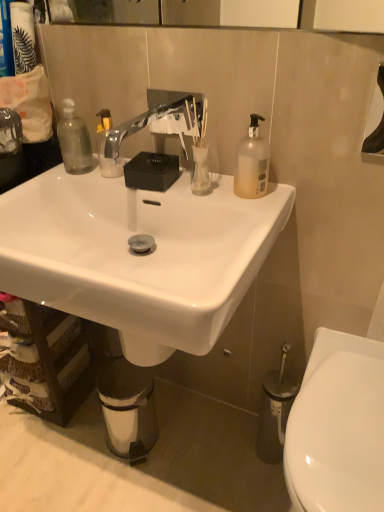
Measure the distance between metallic silver trash can at lower center and camera.

A distance of 3.95 feet exists between metallic silver trash can at lower center and camera.

The image size is (384, 512). Identify the location of metallic silver trash can at lower center. (128, 409).

The image size is (384, 512). In order to click on translucent plastic bottle at upper right in this screenshot , I will do `click(252, 163)`.

What is the approximate height of white glossy sink at center?

The height of white glossy sink at center is 47.66 centimeters.

Describe the element at coordinates (45, 361) in the screenshot. Image resolution: width=384 pixels, height=512 pixels. I see `brown woven basket at lower left` at that location.

The image size is (384, 512). I want to click on white glossy toilet at lower right, so click(338, 426).

Is white glossy toilet at lower right next to brown woven basket at lower left?

No, white glossy toilet at lower right is not with brown woven basket at lower left.

Visually, is white glossy toilet at lower right positioned to the left or to the right of brown woven basket at lower left?

Clearly, white glossy toilet at lower right is on the right of brown woven basket at lower left in the image.

From the image's perspective, is white glossy toilet at lower right located beneath brown woven basket at lower left?

Indeed, from the image's perspective, white glossy toilet at lower right is shown beneath brown woven basket at lower left.

Does white glossy toilet at lower right have a lesser height compared to brown woven basket at lower left?

Correct, white glossy toilet at lower right is not as tall as brown woven basket at lower left.

In the scene shown: Is silver metallic faucet at center not within translucent plastic bottle at upper right?

That's correct, silver metallic faucet at center is outside of translucent plastic bottle at upper right.

From the image's perspective, is silver metallic faucet at center under translucent plastic bottle at upper right?

No, from the image's perspective, silver metallic faucet at center is not beneath translucent plastic bottle at upper right.

Is silver metallic faucet at center in contact with translucent plastic bottle at upper right?

silver metallic faucet at center is not next to translucent plastic bottle at upper right, and they're not touching.

Does point (2, 357) lie behind point (26, 208)?

Yes, it is behind point (26, 208).

Could white glossy sink at center be considered to be inside brown woven basket at lower left?

Actually, white glossy sink at center is outside brown woven basket at lower left.

Considering the sizes of brown woven basket at lower left and white glossy sink at center in the image, is brown woven basket at lower left bigger or smaller than white glossy sink at center?

Considering their sizes, brown woven basket at lower left takes up less space than white glossy sink at center.

Is translucent plastic bottle at upper right shorter than brown woven basket at lower left?

Indeed, translucent plastic bottle at upper right has a lesser height compared to brown woven basket at lower left.

Consider the image. From the image's perspective, would you say translucent plastic bottle at upper right is positioned over brown woven basket at lower left?

Yes, from the image's perspective, translucent plastic bottle at upper right is above brown woven basket at lower left.

Is point (264, 194) in front of point (15, 403)?

Yes, point (264, 194) is in front of point (15, 403).

The width and height of the screenshot is (384, 512). What are the coordinates of `bottle that appears above the brown woven basket at lower left (from a real-world perspective)` in the screenshot? It's located at tap(252, 163).

Which of these two, transparent glass vase at center or white glossy sink at center, stands shorter?

transparent glass vase at center is shorter.

Is transparent glass vase at center positioned beyond the bounds of white glossy sink at center?

transparent glass vase at center lies outside white glossy sink at center's area.

Based on the photo, in terms of size, does transparent glass vase at center appear bigger or smaller than white glossy sink at center?

Clearly, transparent glass vase at center is smaller in size than white glossy sink at center.

From a real-world perspective, is transparent glass vase at center beneath white glossy sink at center?

No, from a real-world perspective, transparent glass vase at center is not below white glossy sink at center.

Would you say transparent glass vase at center is a long distance from translucent plastic bottle at upper right?

No, transparent glass vase at center is in close proximity to translucent plastic bottle at upper right.

In terms of width, does transparent glass vase at center look wider or thinner when compared to translucent plastic bottle at upper right?

Considering their sizes, transparent glass vase at center looks broader than translucent plastic bottle at upper right.

In the scene shown: Which object is positioned more to the left, transparent glass vase at center or translucent plastic bottle at upper right?

Positioned to the left is transparent glass vase at center.

Does point (210, 184) appear closer or farther from the camera than point (254, 181)?

Point (210, 184) is positioned farther from the camera compared to point (254, 181).

Are metallic silver trash can at lower center and white glossy sink at center far apart?

metallic silver trash can at lower center is actually quite close to white glossy sink at center.

Considering the sizes of objects metallic silver trash can at lower center and white glossy sink at center in the image provided, who is shorter, metallic silver trash can at lower center or white glossy sink at center?

metallic silver trash can at lower center.

From the picture: From a real-world perspective, is metallic silver trash can at lower center located higher than white glossy sink at center?

No.

From the image's perspective, which object appears higher, metallic silver trash can at lower center or white glossy sink at center?

white glossy sink at center appears higher in the image.

Locate an element on the screen. The width and height of the screenshot is (384, 512). cabinetry above the white glossy toilet at lower right (from the image's perspective) is located at coordinates (45, 361).

Locate an element on the screen. This screenshot has width=384, height=512. bottle lying behind the silver metallic faucet at center is located at coordinates (252, 163).

Estimate the real-world distances between objects in this image. Which object is further from white glossy sink at center, transparent glass vase at center or translucent plastic bottle at upper right?

The object further to white glossy sink at center is translucent plastic bottle at upper right.

Based on their spatial positions, is brown woven basket at lower left or matte black canister at upper left closer to transparent glass vase at center?

matte black canister at upper left is positioned closer to the anchor transparent glass vase at center.

From the image, which object appears to be nearer to translucent plastic bottle at upper right, silver metallic faucet at center or transparent glass vase at center?

transparent glass vase at center is positioned closer to the anchor translucent plastic bottle at upper right.

Considering their positions, is translucent plastic bottle at upper right positioned further to matte black canister at upper left than silver metallic faucet at center?

The object further to matte black canister at upper left is translucent plastic bottle at upper right.

Looking at this image, from the image, which object appears to be nearer to translucent plastic bottle at upper right, silver metallic faucet at center or white glossy toilet at lower right?

The object closer to translucent plastic bottle at upper right is silver metallic faucet at center.

Based on their spatial positions, is metallic silver trash can at lower center or white glossy toilet at lower right closer to silver metallic faucet at center?

white glossy toilet at lower right is positioned closer to the anchor silver metallic faucet at center.

When comparing their distances from silver metallic faucet at center, does translucent plastic bottle at upper right or brown woven basket at lower left seem further?

The object further to silver metallic faucet at center is brown woven basket at lower left.

Based on their spatial positions, is silver metallic faucet at center or translucent plastic bottle at upper right further from white glossy toilet at lower right?

silver metallic faucet at center.

At what (x,y) coordinates should I click in order to perform the action: click on bottle that lies between silver metallic faucet at center and white glossy sink at center from top to bottom. Please return your answer as a coordinate pair (x, y). Looking at the image, I should click on (252, 163).

Where is `coffee cup between silver metallic faucet at center and translucent plastic bottle at upper right from left to right`? coffee cup between silver metallic faucet at center and translucent plastic bottle at upper right from left to right is located at coordinates (200, 170).

Identify the location of trash bin/can between matte black canister at upper left and white glossy toilet at lower right vertically. This screenshot has width=384, height=512. (128, 409).

You are a GUI agent. You are given a task and a screenshot of the screen. Output one action in this format:
    pyautogui.click(x=<x>, y=<y>)
    Task: Click on the coffee cup located between brown woven basket at lower left and white glossy toilet at lower right in the left-right direction
    This screenshot has height=512, width=384.
    Given the screenshot: What is the action you would take?
    pyautogui.click(x=200, y=170)